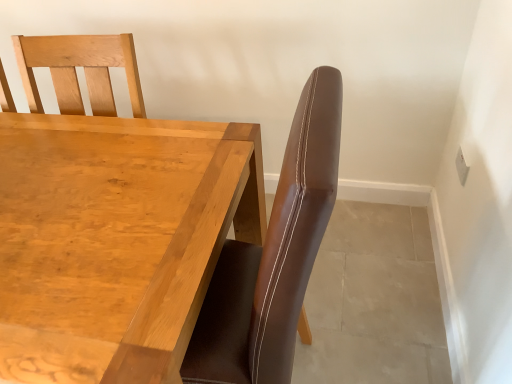
At what (x,y) coordinates should I click in order to perform the action: click on free space above light brown wood table at center (from a real-world perspective). Please return your answer as a coordinate pair (x, y). This screenshot has height=384, width=512. Looking at the image, I should click on (74, 190).